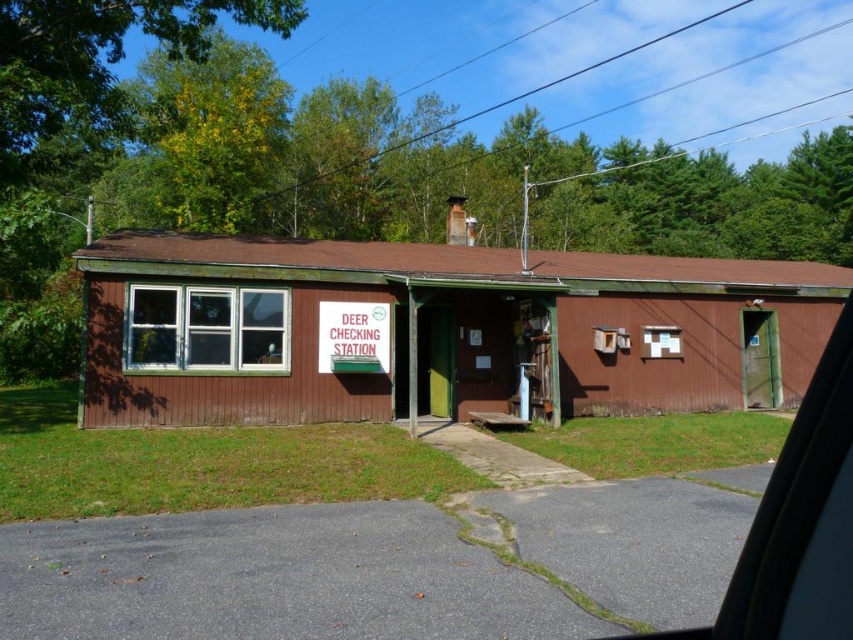
You are a visitor at the Deer Checking Station and need to locate the brown woodshed at center and the white plastic sign at center. Based on the scene description, which object is positioned higher relative to the other?

The brown woodshed at center is located above the white plastic sign at center, so it is positioned higher than the sign.

You are a visitor at the Deer Checking Station and need to hang a new sign that is taller than the existing white plastic sign at center. Can the brown woodshed at center accommodate the new sign in terms of height?

The brown woodshed at center has a greater height compared to the white plastic sign at center, so yes, the new sign can be accommodated on the brown woodshed at center as it is taller than the existing sign.